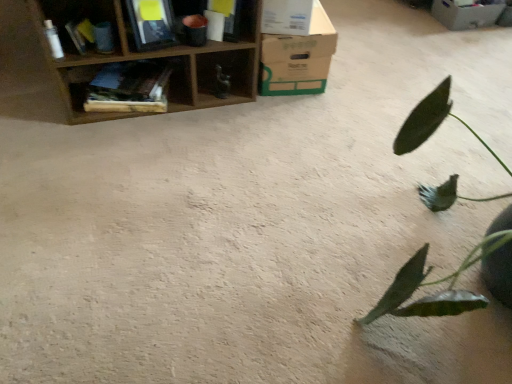
Question: From the image's perspective, does wooden bookshelf at upper left, the second shelf when ordered from right to left, appear higher than wooden bookshelf at upper left, the 3th shelf when ordered from right to left?

Choices:
 (A) yes
 (B) no

Answer: (B)

Question: Is wooden bookshelf at upper left, which is the second shelf in left-to-right order, aimed at wooden bookshelf at upper left, the 1th shelf from the left?

Choices:
 (A) no
 (B) yes

Answer: (A)

Question: Does wooden bookshelf at upper left, which is the second shelf in left-to-right order, have a greater width compared to wooden bookshelf at upper left, the 1th shelf from the left?

Choices:
 (A) yes
 (B) no

Answer: (A)

Question: Is wooden bookshelf at upper left, which is the second shelf in left-to-right order, further to the viewer compared to wooden bookshelf at upper left, the 1th shelf from the left?

Choices:
 (A) no
 (B) yes

Answer: (B)

Question: Does wooden bookshelf at upper left, which is the second shelf in left-to-right order, have a smaller size compared to wooden bookshelf at upper left, the 3th shelf when ordered from right to left?

Choices:
 (A) no
 (B) yes

Answer: (A)

Question: Considering the relative positions of wooden shelf at upper left, which is the third shelf from left to right, and brown cardboard box at upper center, the 1th cardboard box ordered from the bottom, in the image provided, is wooden shelf at upper left, which is the third shelf from left to right, to the left or to the right of brown cardboard box at upper center, the 1th cardboard box ordered from the bottom,?

Choices:
 (A) right
 (B) left

Answer: (B)

Question: From a real-world perspective, is wooden shelf at upper left, which is the third shelf from left to right, above or below brown cardboard box at upper center, the 1th cardboard box ordered from the bottom?

Choices:
 (A) above
 (B) below

Answer: (A)

Question: Based on their sizes in the image, would you say wooden shelf at upper left, which is the third shelf from left to right, is bigger or smaller than brown cardboard box at upper center, which is counted as the 1th cardboard box, starting from the left?

Choices:
 (A) big
 (B) small

Answer: (A)

Question: Which is correct: wooden shelf at upper left, placed as the first shelf when sorted from right to left, is inside brown cardboard box at upper center, the 1th cardboard box ordered from the bottom, or outside of it?

Choices:
 (A) inside
 (B) outside

Answer: (B)

Question: From the image's perspective, relative to green matte leafy plant at right, is brown cardboard box at upper center, which is counted as the 1th cardboard box, starting from the left, above or below?

Choices:
 (A) above
 (B) below

Answer: (A)

Question: Is brown cardboard box at upper center, which is the 2th cardboard box from back to front, in front of or behind green matte leafy plant at right in the image?

Choices:
 (A) front
 (B) behind

Answer: (B)

Question: Is brown cardboard box at upper center, which appears as the first cardboard box when viewed from the front, situated inside green matte leafy plant at right or outside?

Choices:
 (A) outside
 (B) inside

Answer: (A)

Question: From a real-world perspective, relative to green matte leafy plant at right, is brown cardboard box at upper center, the second cardboard box viewed from the top, vertically above or below?

Choices:
 (A) above
 (B) below

Answer: (B)

Question: Is point (288, 84) positioned closer to the camera than point (84, 99)?

Choices:
 (A) closer
 (B) farther

Answer: (B)

Question: Is brown cardboard box at upper center, which is counted as the 1th cardboard box, starting from the left, wider or thinner than wooden bookshelf at upper left, the second shelf when ordered from right to left?

Choices:
 (A) wide
 (B) thin

Answer: (A)